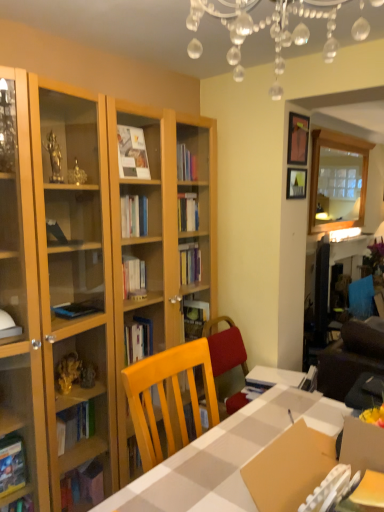
Question: Considering the positions of point (289, 137) and point (354, 37), is point (289, 137) closer or farther from the camera than point (354, 37)?

Choices:
 (A) closer
 (B) farther

Answer: (B)

Question: From their relative heights in the image, would you say matte black picture frame at upper right, which ranks as the second picture frame in bottom-to-top order, is taller or shorter than clear crystal chandelier at upper center?

Choices:
 (A) tall
 (B) short

Answer: (B)

Question: Which is nearer to the clear glass mirror at upper right?

Choices:
 (A) wooden picture frame at upper right, placed as the first picture frame when sorted from bottom to top
 (B) white checkered table at center
 (C) matte black picture frame at upper right, marked as the first picture frame in a top-to-bottom arrangement
 (D) clear crystal chandelier at upper center

Answer: (A)

Question: Estimate the real-world distances between objects in this image. Which object is closer to the wooden picture frame at upper right, the 2th picture frame when ordered from top to bottom?

Choices:
 (A) clear glass mirror at upper right
 (B) white checkered table at center
 (C) clear crystal chandelier at upper center
 (D) matte black picture frame at upper right, which ranks as the second picture frame in bottom-to-top order

Answer: (D)